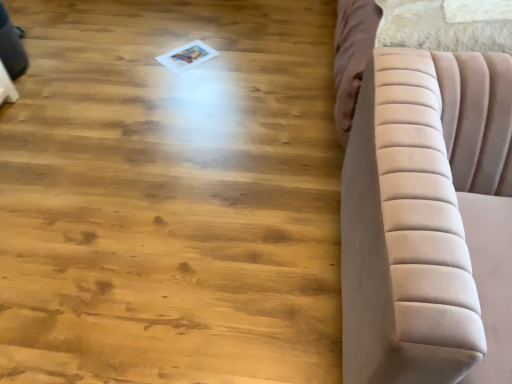
Question: Should I look upward or downward to see velvet beige sofa at right?

Choices:
 (A) up
 (B) down

Answer: (B)

Question: Can you confirm if natural wood floor at center is wider than velvet beige sofa at right?

Choices:
 (A) no
 (B) yes

Answer: (B)

Question: Can you confirm if natural wood floor at center is bigger than velvet beige sofa at right?

Choices:
 (A) yes
 (B) no

Answer: (B)

Question: Considering the relative positions of natural wood floor at center and velvet beige sofa at right in the image provided, is natural wood floor at center to the left of velvet beige sofa at right from the viewer's perspective?

Choices:
 (A) yes
 (B) no

Answer: (A)

Question: Is the depth of natural wood floor at center less than that of velvet beige sofa at right?

Choices:
 (A) yes
 (B) no

Answer: (B)

Question: Is natural wood floor at center thinner than velvet beige sofa at right?

Choices:
 (A) yes
 (B) no

Answer: (B)

Question: Would you say velvet beige sofa at right is part of natural wood floor at center's contents?

Choices:
 (A) yes
 (B) no

Answer: (B)

Question: From a real-world perspective, does velvet beige sofa at right stand above natural wood floor at center?

Choices:
 (A) no
 (B) yes

Answer: (B)

Question: Is velvet beige sofa at right turned away from natural wood floor at center?

Choices:
 (A) no
 (B) yes

Answer: (A)

Question: Is velvet beige sofa at right positioned in front of natural wood floor at center?

Choices:
 (A) no
 (B) yes

Answer: (B)

Question: Can you confirm if velvet beige sofa at right is taller than natural wood floor at center?

Choices:
 (A) no
 (B) yes

Answer: (B)

Question: From the image's perspective, is velvet beige sofa at right under natural wood floor at center?

Choices:
 (A) yes
 (B) no

Answer: (A)

Question: Is velvet beige sofa at right not inside natural wood floor at center?

Choices:
 (A) no
 (B) yes

Answer: (B)

Question: From the image's perspective, relative to velvet beige sofa at right, is natural wood floor at center above or below?

Choices:
 (A) above
 (B) below

Answer: (A)